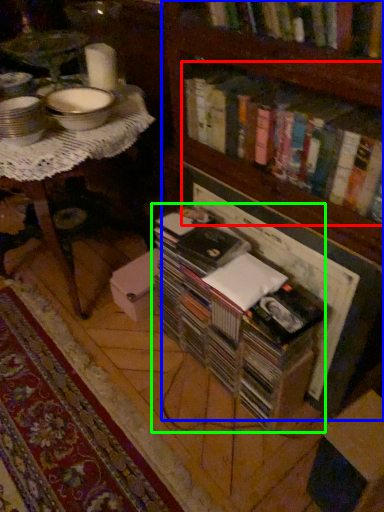
Question: Which object is positioned farthest from book (highlighted by a red box)? Select from bookcase (highlighted by a blue box) and book (highlighted by a green box).

Choices:
 (A) bookcase
 (B) book

Answer: (B)